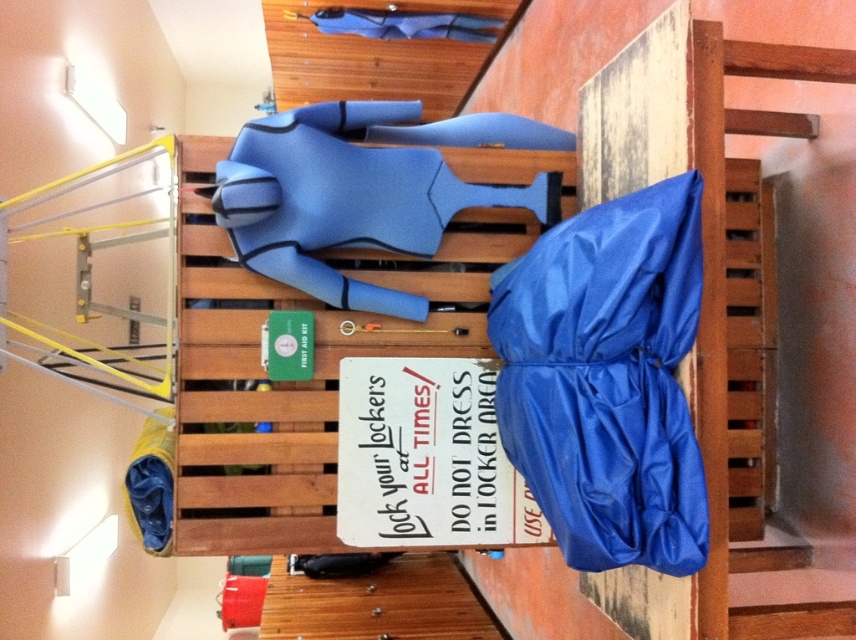
Question: Which point is closer to the camera taking this photo?

Choices:
 (A) (603, 385)
 (B) (235, 262)

Answer: (A)

Question: Among these objects, which one is farthest from the camera?

Choices:
 (A) blue rubber wetsuit at center
 (B) blue nylon bag at right

Answer: (A)

Question: Can you confirm if blue nylon bag at right is wider than blue rubber wetsuit at center?

Choices:
 (A) no
 (B) yes

Answer: (A)

Question: Observing the image, what is the correct spatial positioning of blue nylon bag at right in reference to blue rubber wetsuit at center?

Choices:
 (A) right
 (B) left

Answer: (A)

Question: Can you confirm if blue nylon bag at right is bigger than blue rubber wetsuit at center?

Choices:
 (A) yes
 (B) no

Answer: (B)

Question: Among these points, which one is farthest from the camera?

Choices:
 (A) click(x=452, y=346)
 (B) click(x=643, y=376)

Answer: (A)